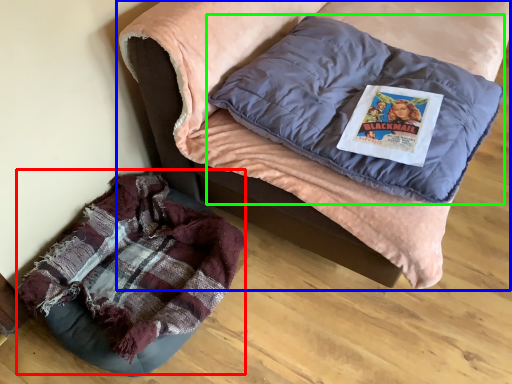
Question: Which object is positioned farthest from bean bag chair (highlighted by a red box)? Select from furniture (highlighted by a blue box) and pillow (highlighted by a green box).

Choices:
 (A) furniture
 (B) pillow

Answer: (B)